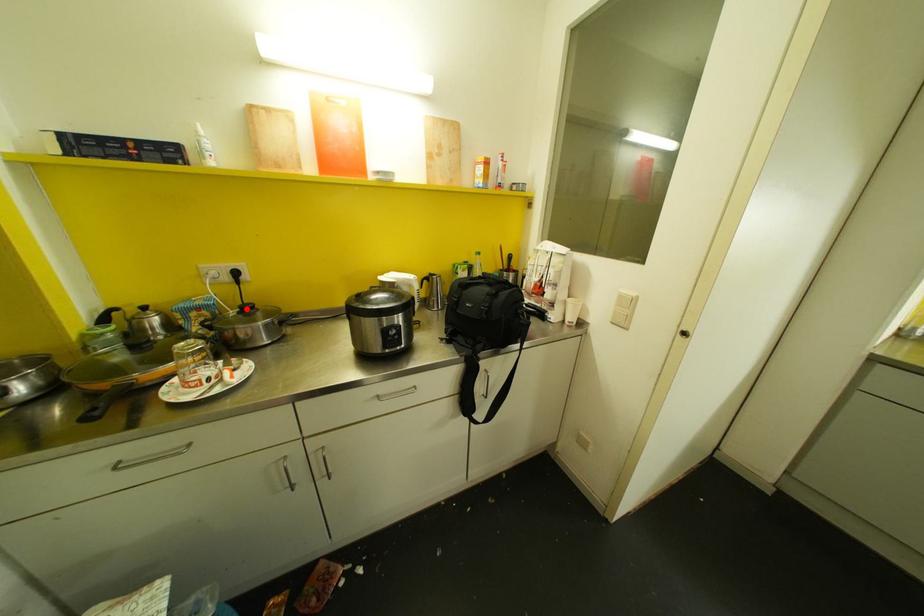
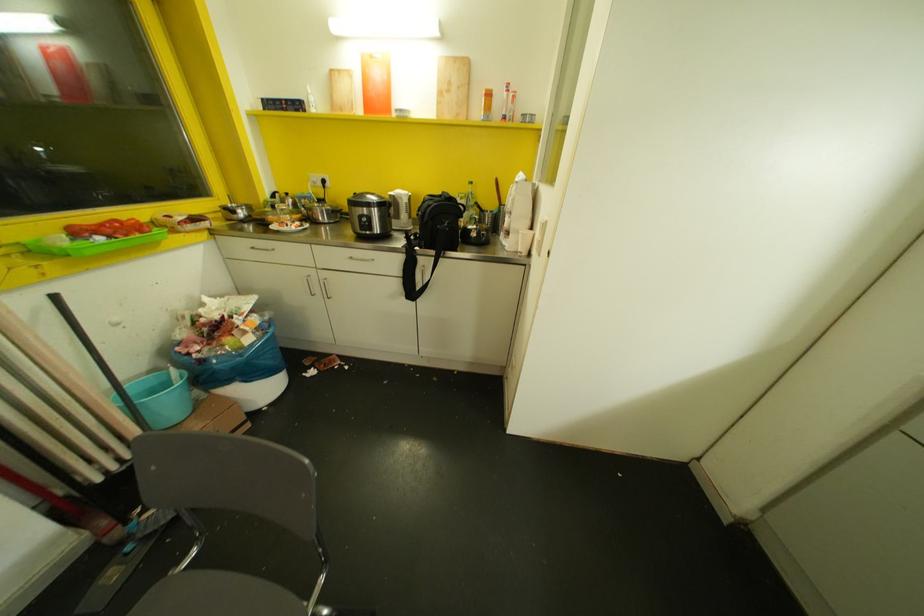
Find the pixel in the second image that matches the highlighted location in the first image.

(320, 200)